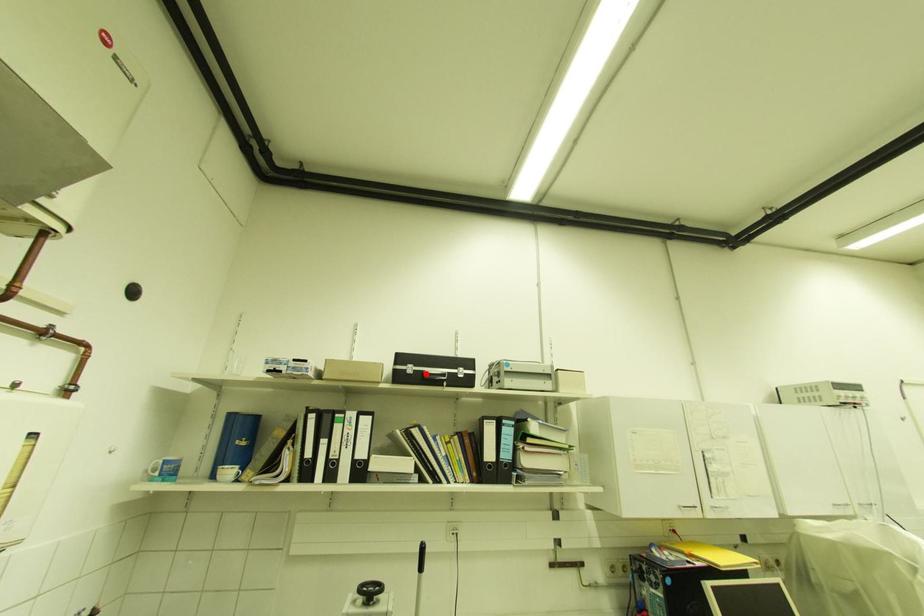
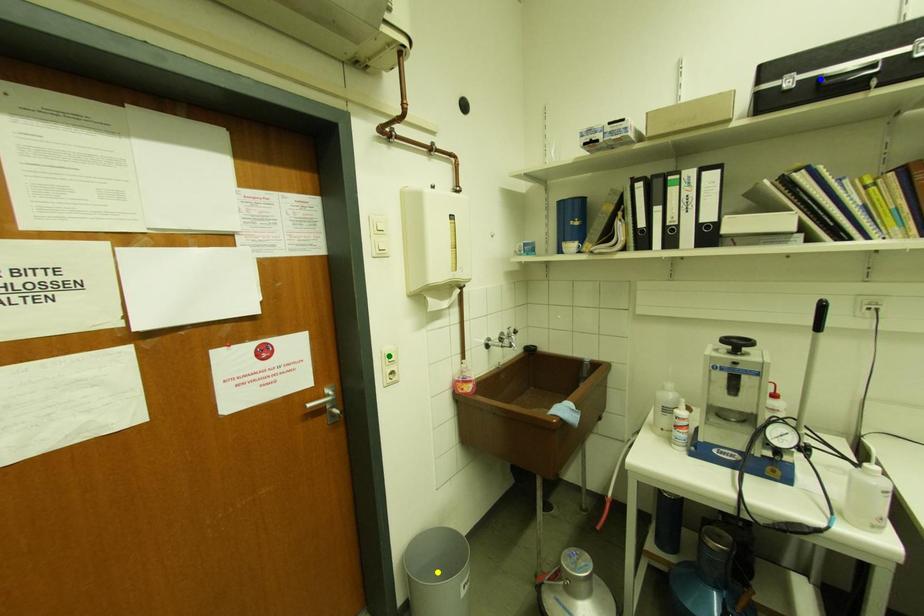
Question: I am providing you with two images of the same scene from different viewpoints. A red point is marked on the first image. You are given multiple points on the second image. Which spot in image 2 lines up with the point in image 1?

Choices:
 (A) yellow point
 (B) blue point
 (C) green point

Answer: (B)